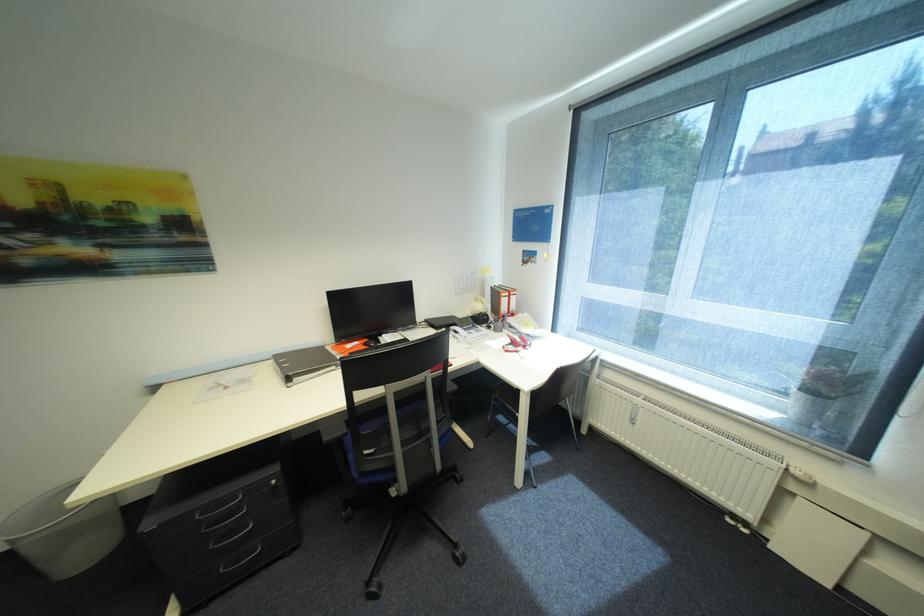
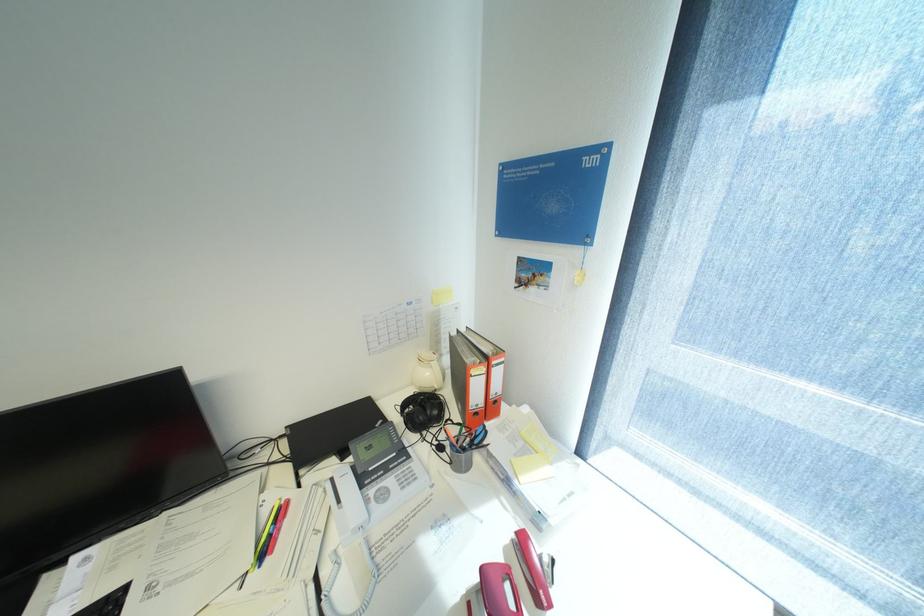
Question: The images are taken continuously from a first-person perspective. In which direction are you moving?

Choices:
 (A) Left
 (B) Right
 (C) Forward
 (D) Backward

Answer: (C)